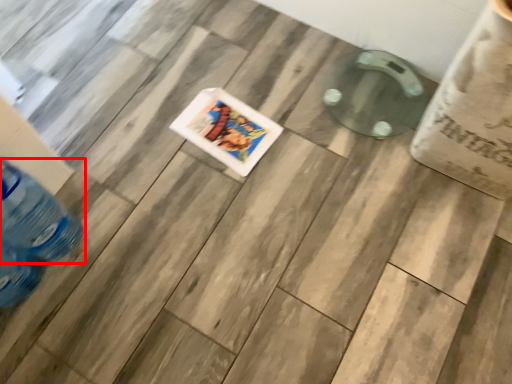
Question: Where is bottle (annotated by the red box) located in relation to comic book in the image?

Choices:
 (A) right
 (B) left

Answer: (B)